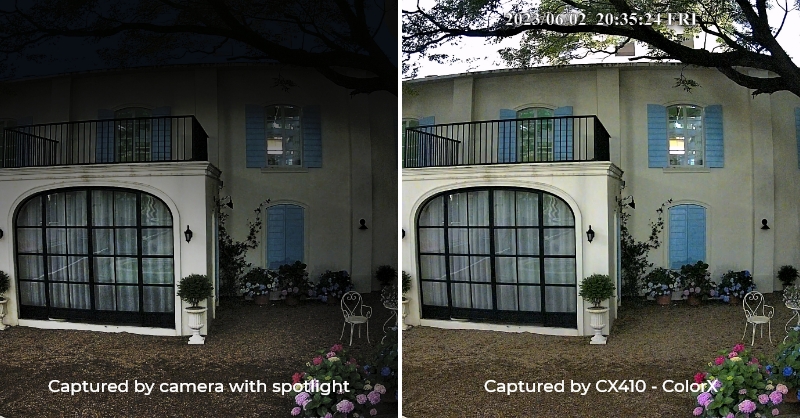
The height and width of the screenshot is (418, 800). In order to click on glass doors in this screenshot , I will do `click(504, 247)`, `click(469, 248)`, `click(105, 237)`.